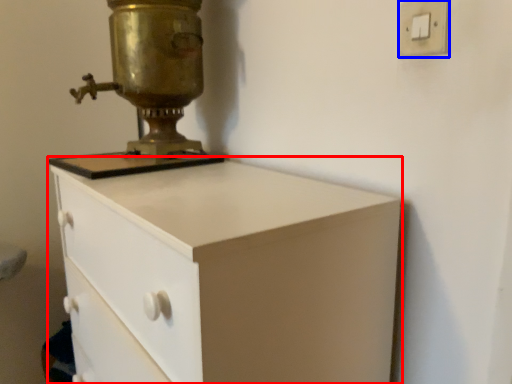
Question: Which point is further to the camera, chest of drawers (highlighted by a red box) or light switch (highlighted by a blue box)?

Choices:
 (A) chest of drawers
 (B) light switch

Answer: (B)